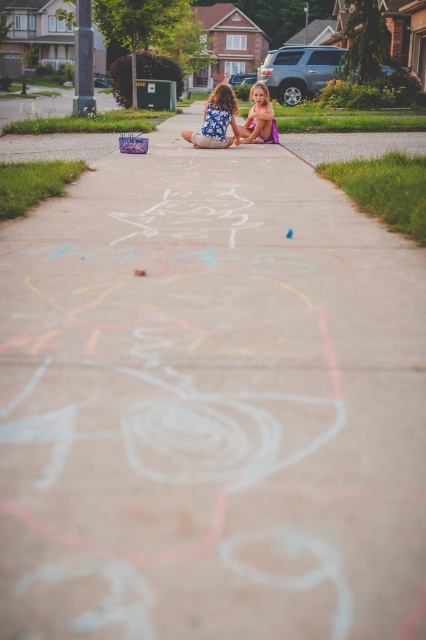
You are a fashion designer observing two dresses displayed side by side on a runway. The dresses are the blue floral dress at center and the matte purple dress at center. Based on their appearance, which dress is narrower?

The blue floral dress at center is narrower than the matte purple dress at center.

You are a photographer wanting to capture both the blue floral dress at center and the matte purple dress at center in the same frame. Which dress should you position closer to the left side of your camera viewfinder to ensure both are visible?

To ensure both the blue floral dress at center and the matte purple dress at center are visible, position the blue floral dress at center closer to the left side of the camera viewfinder since it is already on the left side of the matte purple dress at center.